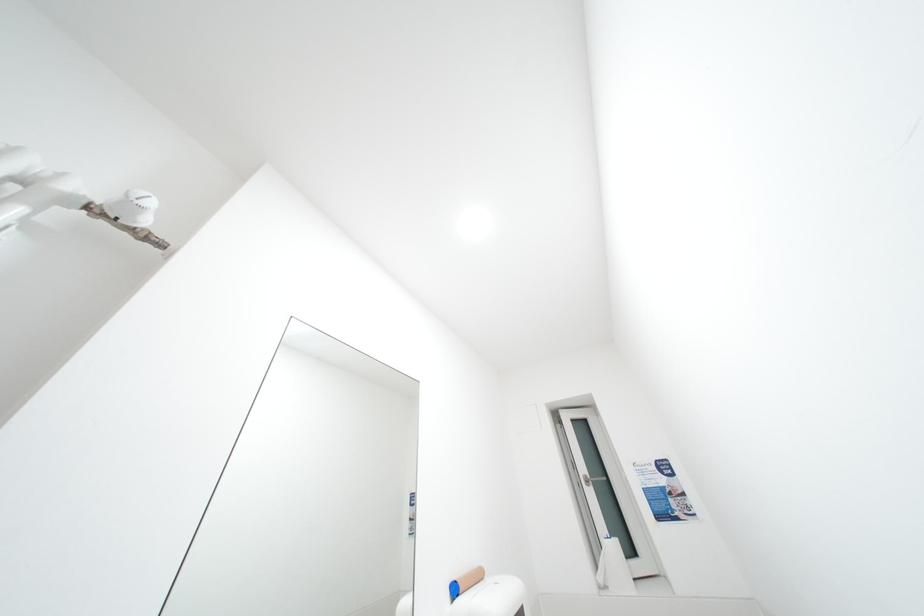
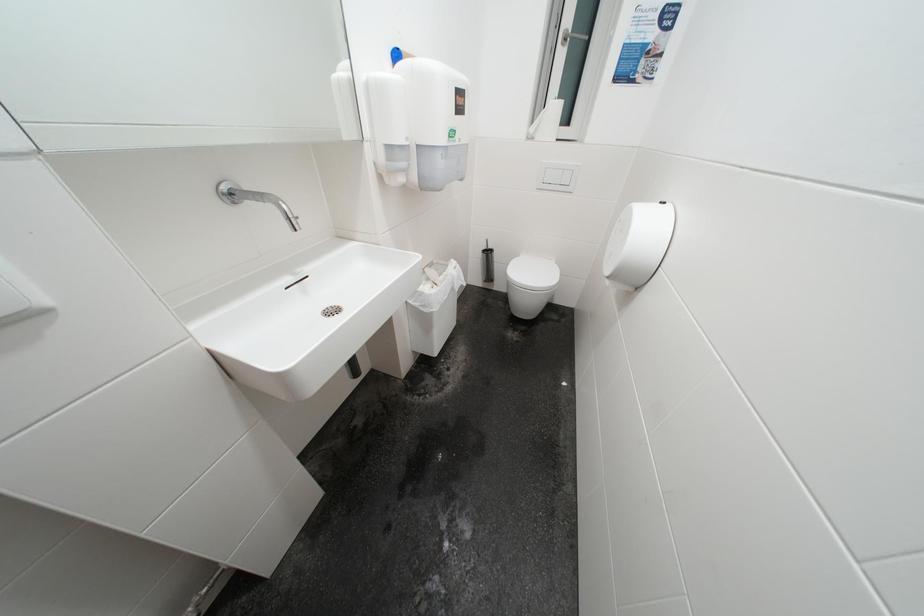
From the picture: The images are taken continuously from a first-person perspective. In which direction is your viewpoint rotating?

The camera's rotation is toward right-down.